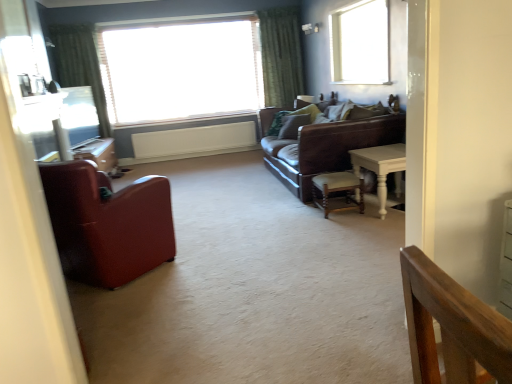
Question: Is green textured curtain at upper center, positioned as the 1th curtain in right-to-left order, directly adjacent to matte glass window screen at left?

Choices:
 (A) yes
 (B) no

Answer: (B)

Question: From the image's perspective, would you say green textured curtain at upper center, positioned as the 1th curtain in right-to-left order, is positioned over matte glass window screen at left?

Choices:
 (A) yes
 (B) no

Answer: (A)

Question: From a real-world perspective, is green textured curtain at upper center, positioned as the 1th curtain in right-to-left order, over matte glass window screen at left?

Choices:
 (A) no
 (B) yes

Answer: (B)

Question: Is green textured curtain at upper center, positioned as the 1th curtain in right-to-left order, bigger than matte glass window screen at left?

Choices:
 (A) yes
 (B) no

Answer: (A)

Question: Does green textured curtain at upper center, positioned as the 1th curtain in right-to-left order, appear on the left side of matte glass window screen at left?

Choices:
 (A) yes
 (B) no

Answer: (B)

Question: Is green fabric curtain at upper left, which is the second curtain in right-to-left order, bigger or smaller than white wooden table at right?

Choices:
 (A) small
 (B) big

Answer: (B)

Question: Does point (53, 39) appear closer or farther from the camera than point (355, 152)?

Choices:
 (A) closer
 (B) farther

Answer: (B)

Question: From the image's perspective, is green fabric curtain at upper left, which appears as the first curtain when viewed from the left, positioned above or below white wooden table at right?

Choices:
 (A) above
 (B) below

Answer: (A)

Question: Is green fabric curtain at upper left, which is the second curtain in right-to-left order, inside or outside of white wooden table at right?

Choices:
 (A) inside
 (B) outside

Answer: (B)

Question: Does point click(x=398, y=157) appear closer or farther from the camera than point click(x=327, y=196)?

Choices:
 (A) farther
 (B) closer

Answer: (B)

Question: From a real-world perspective, is white wooden table at right above or below wooden chair at center, which ranks as the first chair in back-to-front order?

Choices:
 (A) below
 (B) above

Answer: (B)

Question: From the image's perspective, is white wooden table at right positioned above or below wooden chair at center, the 2th chair from the front?

Choices:
 (A) above
 (B) below

Answer: (A)

Question: Do you think white wooden table at right is within wooden chair at center, positioned as the first chair in right-to-left order, or outside of it?

Choices:
 (A) outside
 (B) inside

Answer: (A)

Question: From a real-world perspective, is transparent glass window at upper right, the 2th window viewed from the back, positioned above or below matte glass window screen at left?

Choices:
 (A) above
 (B) below

Answer: (A)

Question: Is point (386, 43) positioned closer to the camera than point (61, 109)?

Choices:
 (A) closer
 (B) farther

Answer: (A)